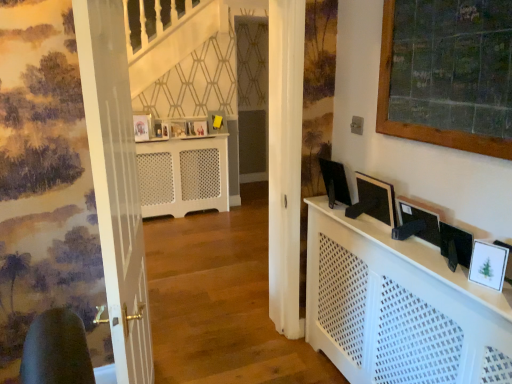
Identify the location of vacant space situated on the left part of matte black monitor at right, placed as the 3th computer monitor when sorted from left to right. (423, 261).